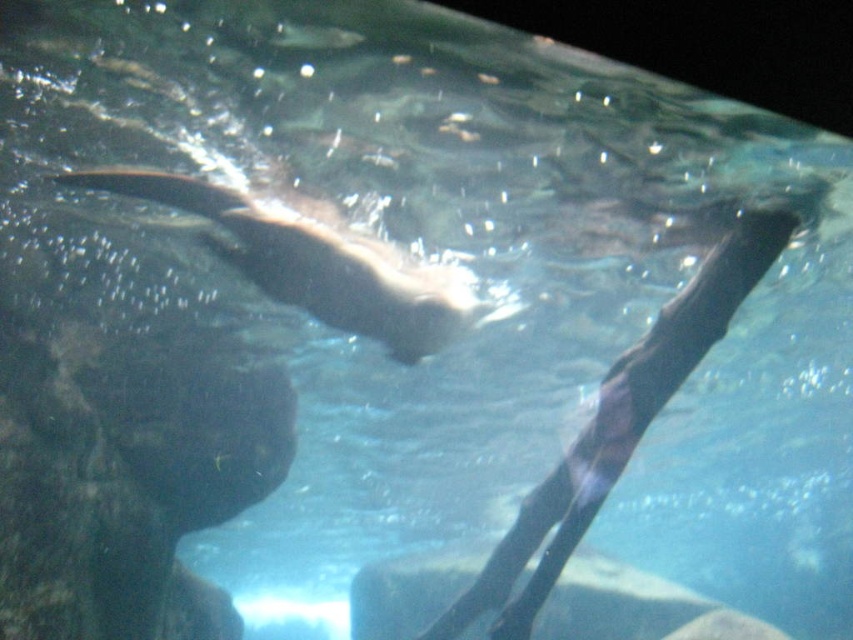
Does point (577, 452) lie in front of point (674, 632)?

Yes, point (577, 452) is in front of point (674, 632).

Which of these two, smooth black seal at center or smooth gray rock at center, stands taller?

smooth gray rock at center

Locate an element on the screen. The height and width of the screenshot is (640, 853). smooth black seal at center is located at coordinates (618, 428).

Can you confirm if smooth black seal at center is taller than shiny brown otter at center?

In fact, smooth black seal at center may be shorter than shiny brown otter at center.

Does point (677, 372) lie behind point (131, 176)?

Yes, point (677, 372) is farther from viewer.

Where is `smooth black seal at center`? smooth black seal at center is located at coordinates (618, 428).

Is shiny brown otter at center thinner than smooth gray rock at center?

Yes.

Describe the element at coordinates (311, 264) in the screenshot. I see `shiny brown otter at center` at that location.

Locate an element on the screen. The height and width of the screenshot is (640, 853). shiny brown otter at center is located at coordinates (311, 264).